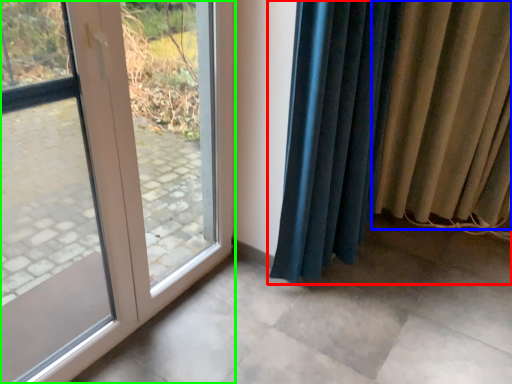
Question: Based on their relative distances, which object is nearer to curtain (highlighted by a red box)? Choose from curtain (highlighted by a blue box) and door (highlighted by a green box).

Choices:
 (A) curtain
 (B) door

Answer: (A)